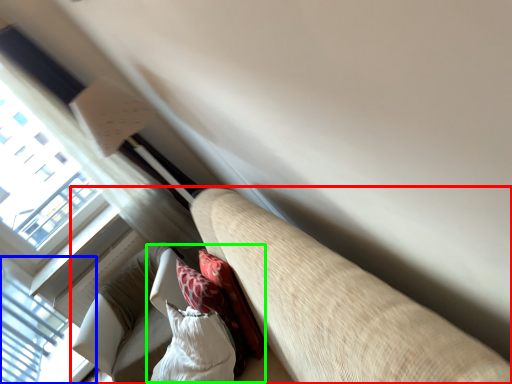
Question: Estimate the real-world distances between objects in this image. Which object is closer to studio couch (highlighted by a red box), window (highlighted by a blue box) or bean bag chair (highlighted by a green box)?

Choices:
 (A) window
 (B) bean bag chair

Answer: (B)